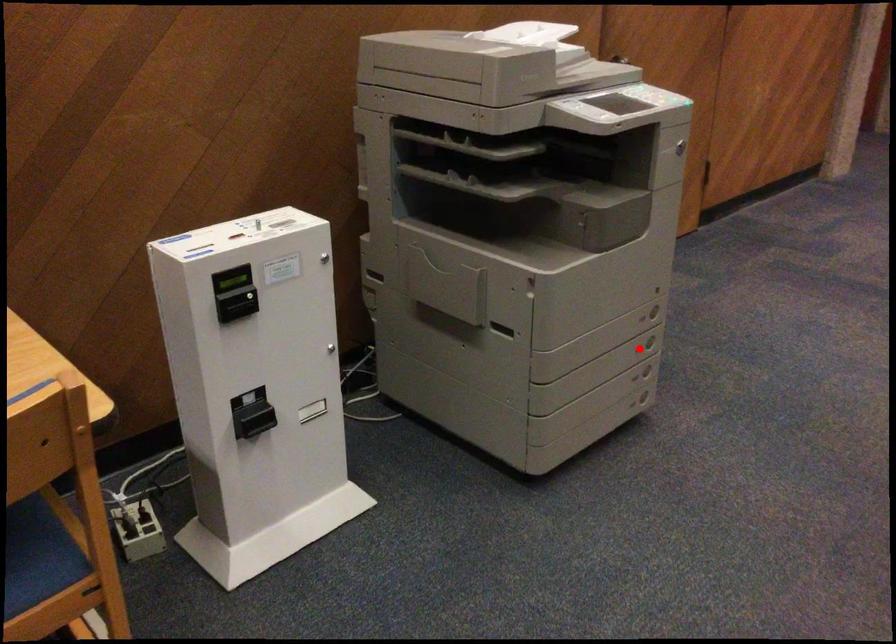
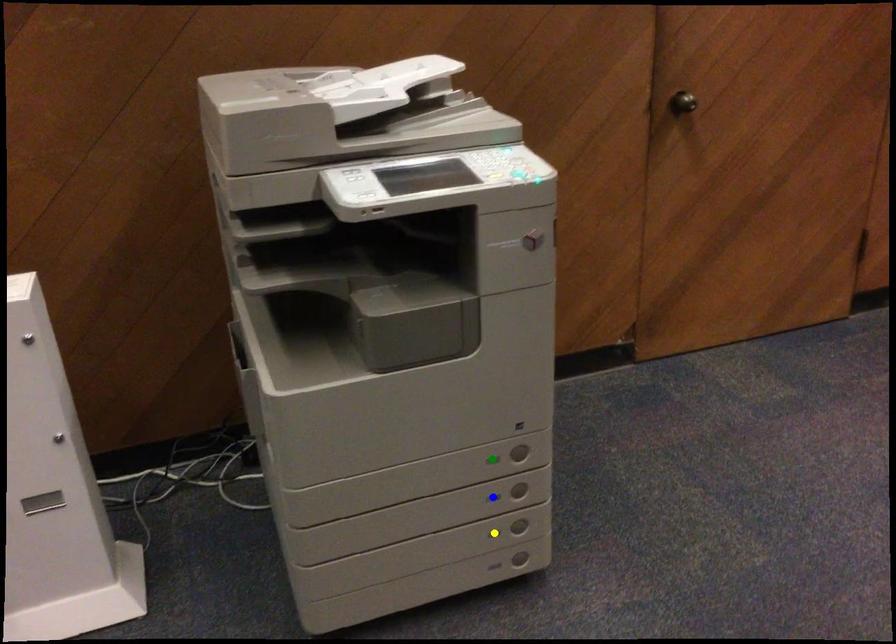
Question: I am providing you with two images of the same scene from different viewpoints. A red point is marked on the first image. You are given multiple points on the second image. Which point in image 2 is actually the same real-world point as the red point in image 1?

Choices:
 (A) yellow point
 (B) blue point
 (C) green point

Answer: (B)